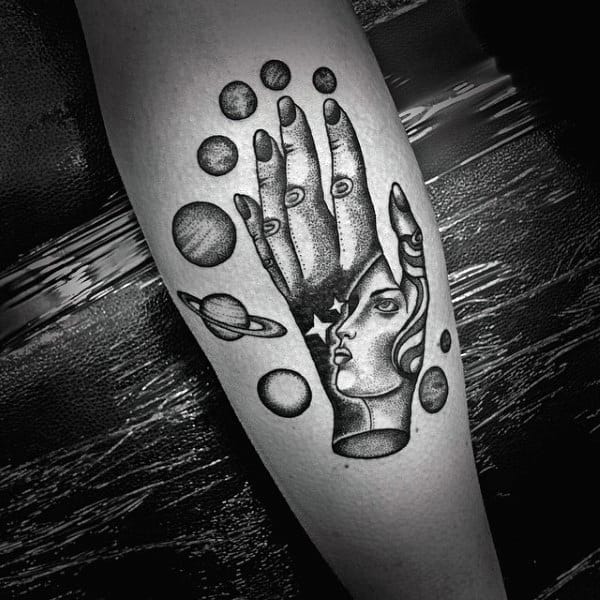
Find the location of a particular element. black wood surface is located at coordinates (496, 289).